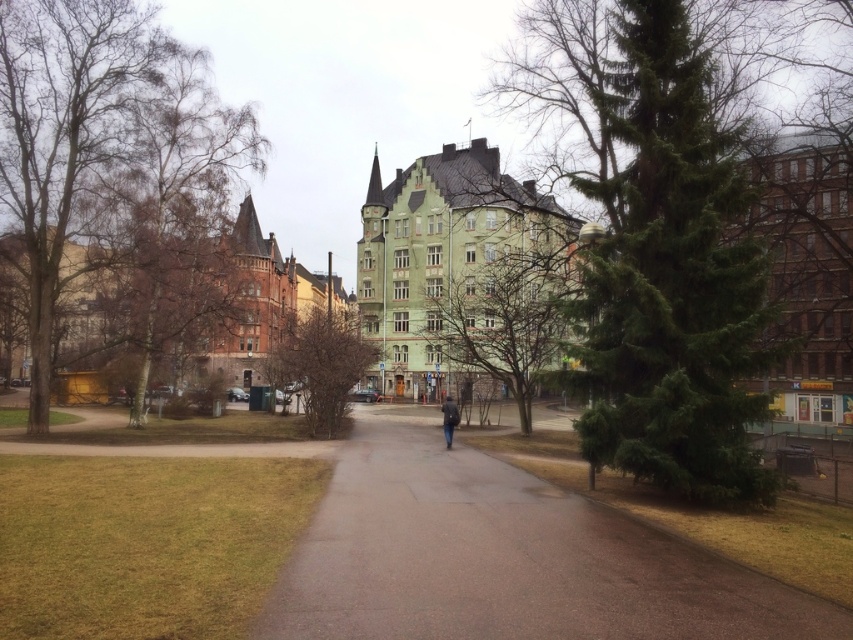
Measure the distance from bare birch tree at left to green matte tree at center.

A distance of 27.73 meters exists between bare birch tree at left and green matte tree at center.

Who is taller, bare birch tree at left or green matte tree at center?

bare birch tree at left

This screenshot has height=640, width=853. What are the coordinates of `bare birch tree at left` in the screenshot? It's located at (102, 145).

The width and height of the screenshot is (853, 640). I want to click on bare birch tree at left, so click(x=102, y=145).

Does brown textured bush at center come in front of dark gray jacket at center?

No, it is not.

Find the location of `brown textured bush at center`. brown textured bush at center is located at coordinates (321, 364).

Which is below, brown asphalt path at center or bare birch tree at left?

brown asphalt path at center is below.

Can you confirm if brown asphalt path at center is positioned to the left of bare birch tree at left?

In fact, brown asphalt path at center is to the right of bare birch tree at left.

Does point (390, 547) lie in front of point (73, 1)?

Yes, it is.

Identify the location of brown asphalt path at center. The width and height of the screenshot is (853, 640). (503, 557).